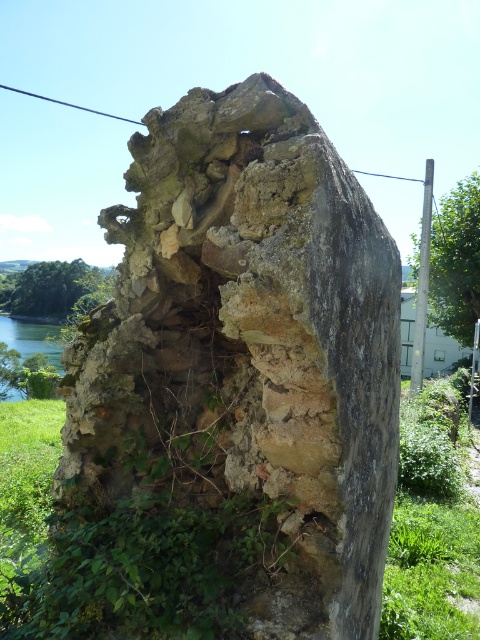
Question: Among these points, which one is nearest to the camera?

Choices:
 (A) (74, 378)
 (B) (474, 260)

Answer: (A)

Question: Can you confirm if weathered stone wall at center is positioned above green leafy vegetation at right?

Choices:
 (A) no
 (B) yes

Answer: (A)

Question: Which object is the farthest from the green leafy vegetation at right?

Choices:
 (A) green leafy vegetation at left
 (B) weathered stone wall at center

Answer: (B)

Question: Can you confirm if weathered stone wall at center is smaller than green water at left?

Choices:
 (A) no
 (B) yes

Answer: (B)

Question: Which point is farther to the camera?

Choices:
 (A) (415, 272)
 (B) (112, 346)
 (C) (33, 272)

Answer: (C)

Question: Can you confirm if weathered stone wall at center is wider than green water at left?

Choices:
 (A) no
 (B) yes

Answer: (A)